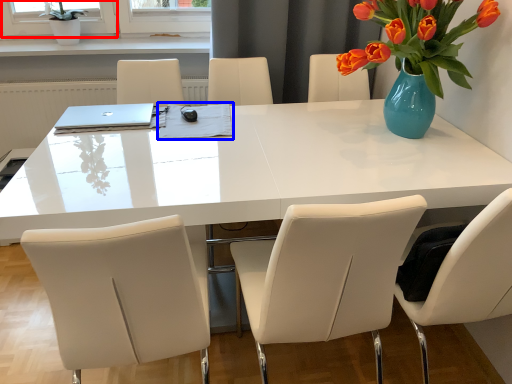
Question: Which object appears farthest to the camera in this image, window screen (highlighted by a red box) or notepad (highlighted by a blue box)?

Choices:
 (A) window screen
 (B) notepad

Answer: (A)